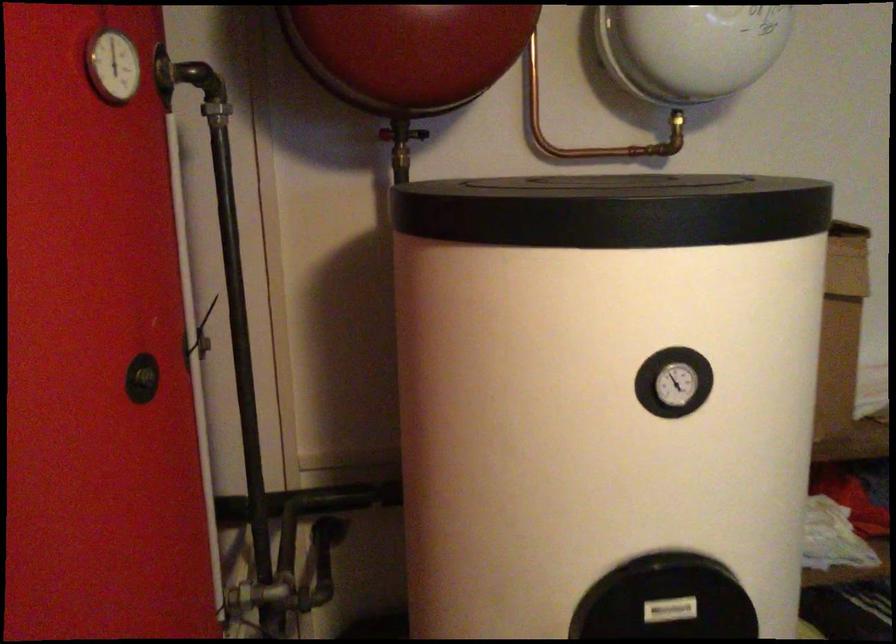
What do you see at coordinates (395, 133) in the screenshot? I see `a red valve handle` at bounding box center [395, 133].